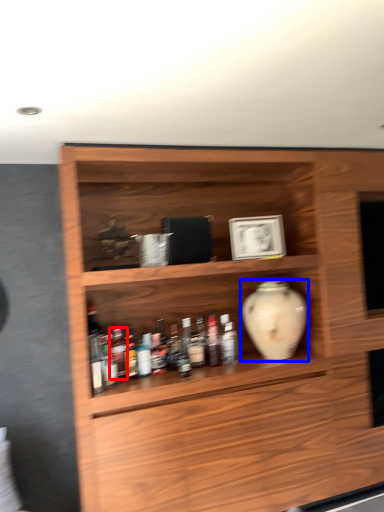
Question: Which object appears farthest to the camera in this image, bottle (highlighted by a red box) or vase (highlighted by a blue box)?

Choices:
 (A) bottle
 (B) vase

Answer: (B)